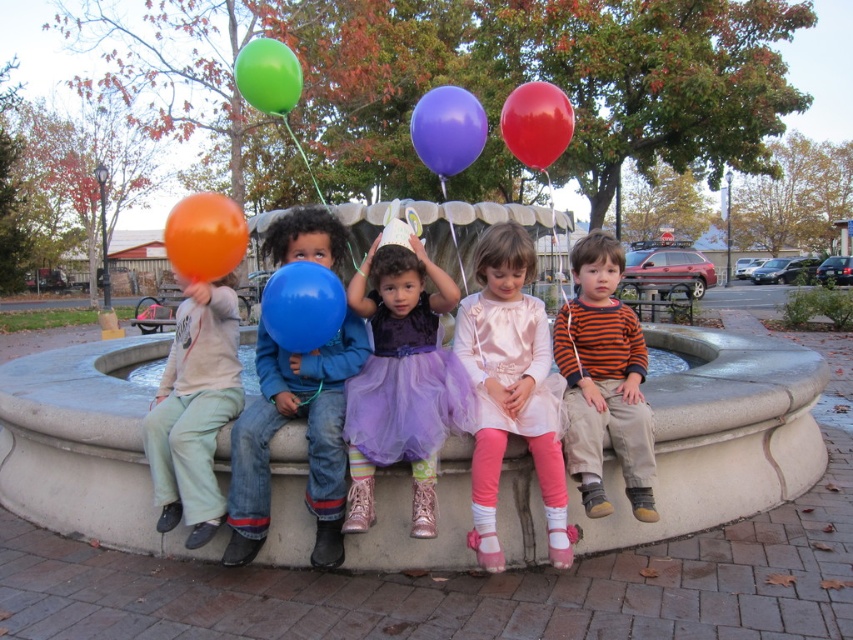
Is purple tulle dress at center wider than light gray cotton shirt at left?

Correct, the width of purple tulle dress at center exceeds that of light gray cotton shirt at left.

Does point (408, 413) come behind point (210, 509)?

No, (408, 413) is closer to viewer.

This screenshot has height=640, width=853. Find the location of `purple tulle dress at center`. purple tulle dress at center is located at coordinates (401, 380).

Can you confirm if pink satin dress at center is positioned to the left of orange rubber balloon at left?

Incorrect, pink satin dress at center is not on the left side of orange rubber balloon at left.

Is point (485, 332) closer to viewer compared to point (206, 244)?

No.

Identify the location of pink satin dress at center. This screenshot has height=640, width=853. (511, 388).

Is point (316, 444) closer to camera compared to point (567, 100)?

Yes, point (316, 444) is closer to viewer.

Measure the distance between point [281,369] and camera.

The distance of point [281,369] from camera is 3.05 meters.

The width and height of the screenshot is (853, 640). Identify the location of blue matte balloon at center. (305, 436).